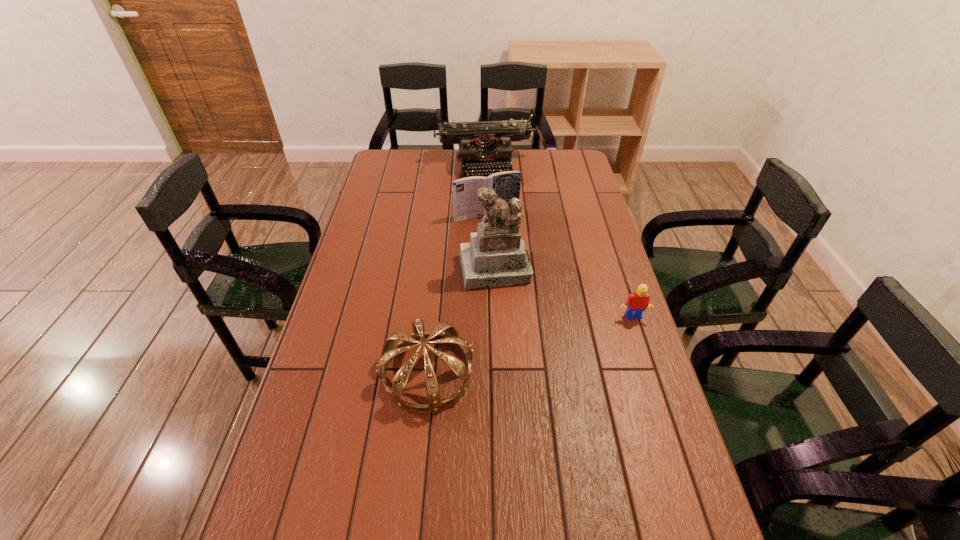
This screenshot has width=960, height=540. In order to click on vacant space located 0.230m on the front cover of the second farthest object in this screenshot , I will do `click(516, 262)`.

Find the location of a particular element. vacant space located on the front cover of the second farthest object is located at coordinates (519, 268).

I want to click on vacant space situated 0.090m on the front-facing side of the figurine, so click(505, 310).

Where is `vacant space located on the front-facing side of the figurine`? The image size is (960, 540). vacant space located on the front-facing side of the figurine is located at coordinates (520, 388).

The image size is (960, 540). In order to click on vacant space located on the front-facing side of the figurine in this screenshot , I will do `click(506, 315)`.

Identify the location of vacant space situated on the keyboard of the farthest object. The image size is (960, 540). (498, 210).

The image size is (960, 540). Identify the location of free spot located on the keyboard of the farthest object. (502, 222).

Locate an element on the screen. This screenshot has height=540, width=960. free spot located 0.100m on the keyboard of the farthest object is located at coordinates (496, 201).

The height and width of the screenshot is (540, 960). What are the coordinates of `object that is at the far edge` in the screenshot? It's located at (484, 146).

Where is `object that is at the right edge`? object that is at the right edge is located at coordinates (636, 303).